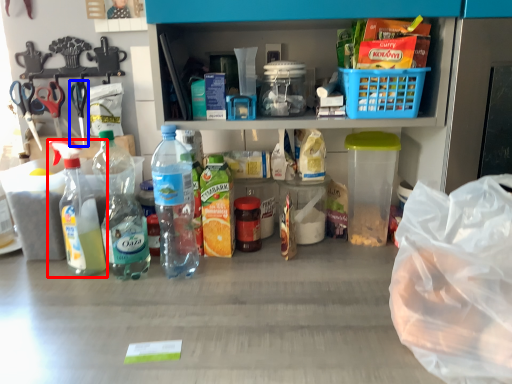
Question: Which point is further to the camera, bottle (highlighted by a red box) or scissors (highlighted by a blue box)?

Choices:
 (A) bottle
 (B) scissors

Answer: (B)